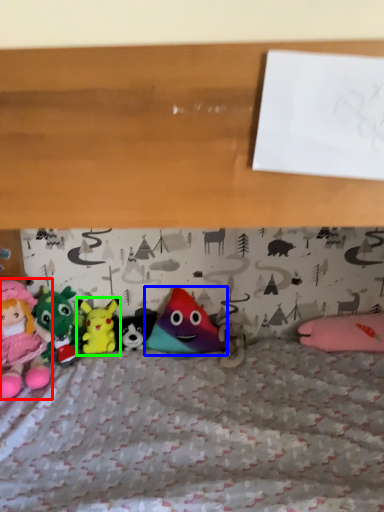
Question: Estimate the real-world distances between objects in this image. Which object is closer to toy (highlighted by a red box), toy (highlighted by a blue box) or toy (highlighted by a green box)?

Choices:
 (A) toy
 (B) toy

Answer: (B)